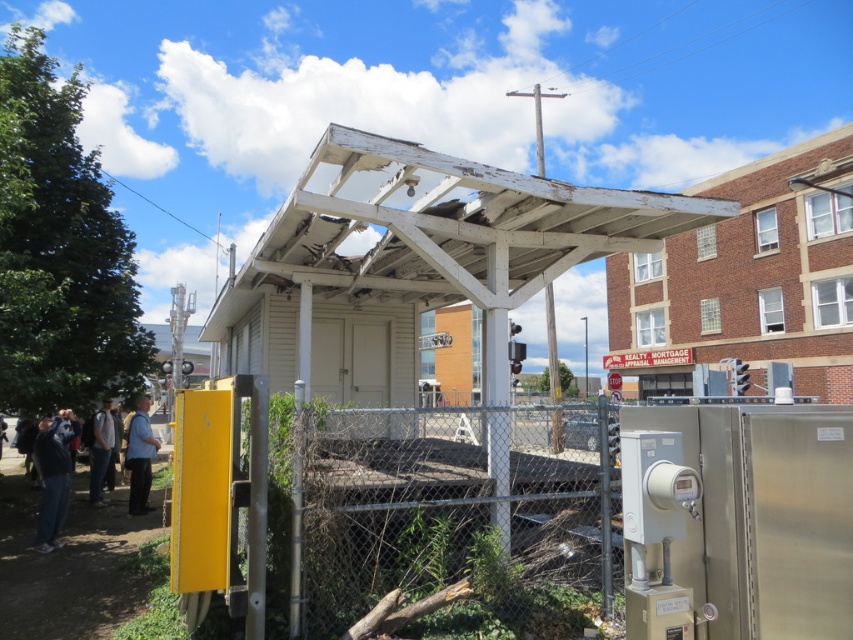
Question: Does dark gray hoodie at lower left come behind blue fabric shirt at lower left?

Choices:
 (A) no
 (B) yes

Answer: (A)

Question: Among these points, which one is farthest from the camera?

Choices:
 (A) (61, 481)
 (B) (497, 497)

Answer: (A)

Question: Which of the following is the closest to the observer?

Choices:
 (A) (328, 636)
 (B) (96, 493)
 (C) (45, 426)

Answer: (A)

Question: Does brick building at upper right have a larger size compared to blue fabric shirt at lower left?

Choices:
 (A) yes
 (B) no

Answer: (A)

Question: Which is nearer to the light brown leather jacket at lower left?

Choices:
 (A) dark gray hoodie at lower left
 (B) blue fabric shirt at lower left

Answer: (B)

Question: Is the position of brick building at upper right less distant than that of blue fabric shirt at lower left?

Choices:
 (A) yes
 (B) no

Answer: (A)